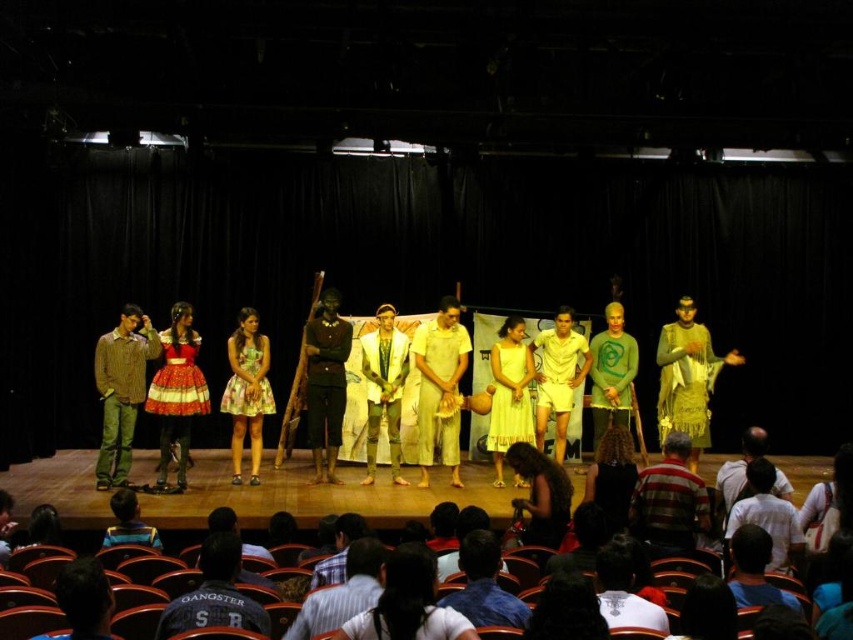
Question: Which of the following is the closest to the observer?

Choices:
 (A) striped brown shirt at left
 (B) shiny gold jacket at center

Answer: (A)

Question: Which point is closer to the camera?

Choices:
 (A) (608, 403)
 (B) (675, 461)
 (C) (138, 522)

Answer: (C)

Question: Which object appears farthest from the camera in this image?

Choices:
 (A) dark green fabric uniform at center
 (B) white matte shorts at center

Answer: (B)

Question: Can you confirm if striped brown shirt at left is positioned to the left of striped shirt at center?

Choices:
 (A) no
 (B) yes

Answer: (B)

Question: Does striped cotton shirt at center appear on the left side of striped shirt at center?

Choices:
 (A) yes
 (B) no

Answer: (B)

Question: Is white cotton shirt at lower right behind light brown leather jacket at center?

Choices:
 (A) yes
 (B) no

Answer: (B)